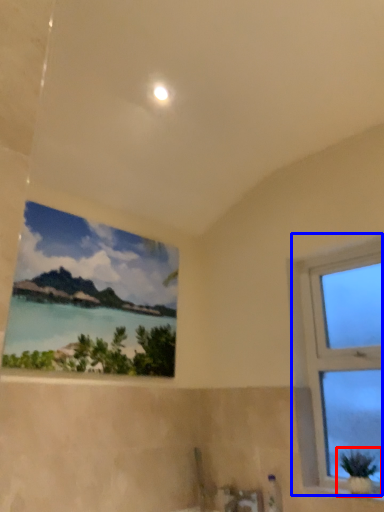
Question: Among these objects, which one is nearest to the camera, houseplant (highlighted by a red box) or window (highlighted by a blue box)?

Choices:
 (A) houseplant
 (B) window

Answer: (A)